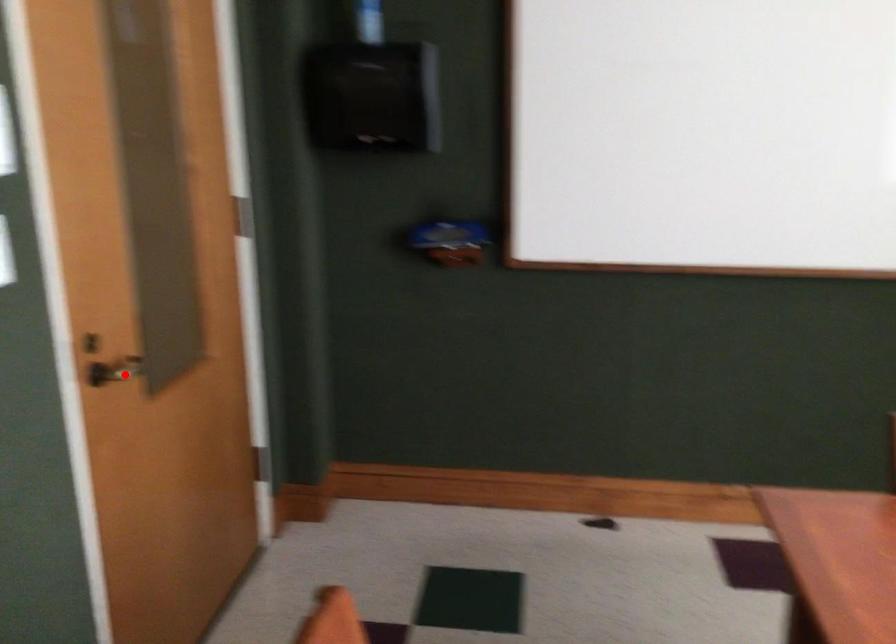
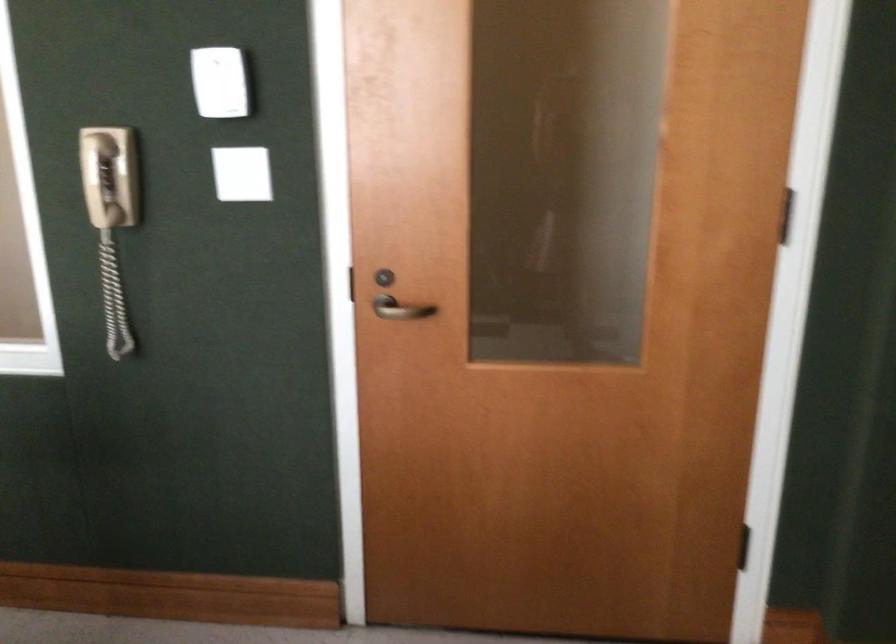
The point at the highlighted location is marked in the first image. Where is the corresponding point in the second image?

(401, 308)